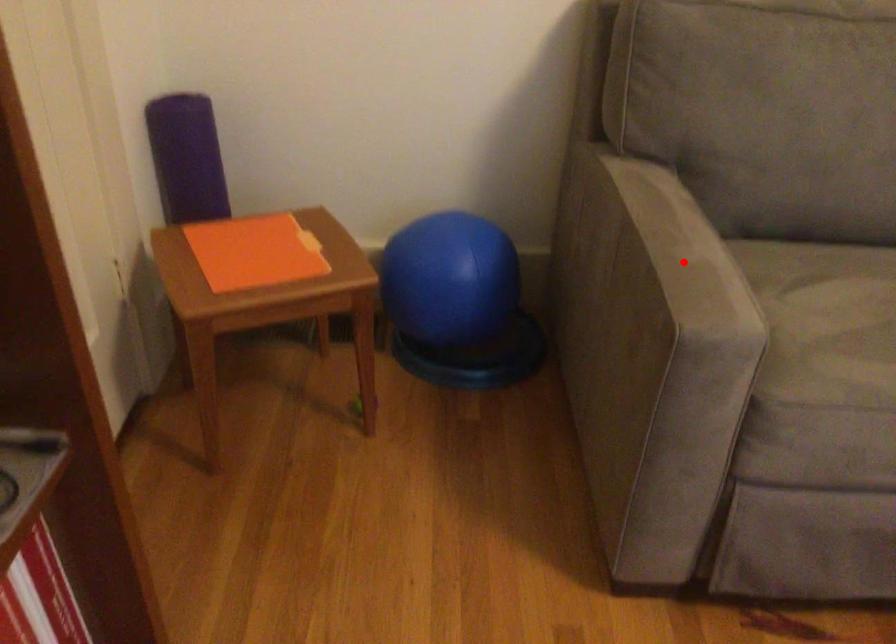
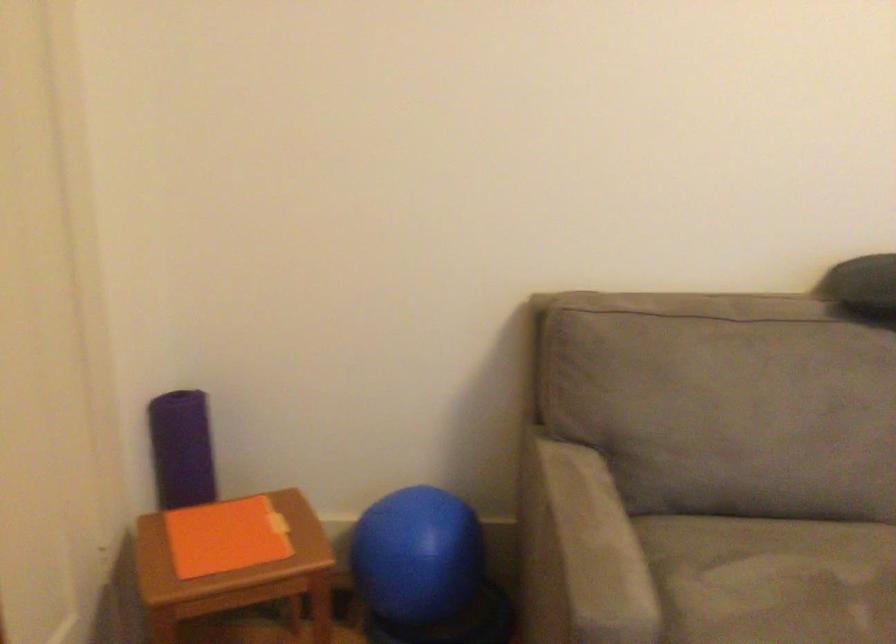
Find the pixel in the second image that matches the highlighted location in the first image.

(588, 550)